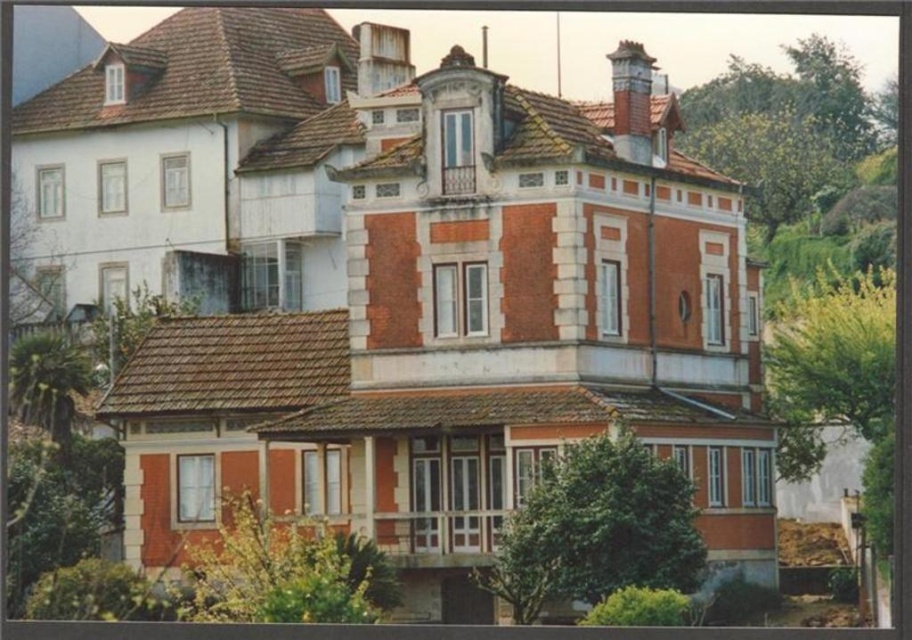
Is green leafy tree at center thinner than green leafy bush at lower left?

Yes, green leafy tree at center is thinner than green leafy bush at lower left.

Between green leafy tree at center and green leafy bush at lower left, which one has more height?

Standing taller between the two is green leafy bush at lower left.

You are a GUI agent. You are given a task and a screenshot of the screen. Output one action in this format:
    pyautogui.click(x=<x>, y=<y>)
    Task: Click on the green leafy tree at center
    This screenshot has width=912, height=640.
    Given the screenshot: What is the action you would take?
    pyautogui.click(x=596, y=529)

Identify the location of green leafy tree at center. The height and width of the screenshot is (640, 912). (596, 529).

Is point (226, 588) farther from viewer compared to point (758, 161)?

No, (226, 588) is in front of (758, 161).

Does green leafy bush at lower left have a lesser height compared to green leafy tree at upper right?

Yes, green leafy bush at lower left is shorter than green leafy tree at upper right.

Based on the photo, who is more forward, (225,516) or (811,116)?

Point (225,516) is in front.

Where is `green leafy bush at lower left`? This screenshot has height=640, width=912. green leafy bush at lower left is located at coordinates (275, 570).

Between point (696, 512) and point (832, 152), which one is positioned behind?

The point (832, 152) is more distant.

Where is `green leafy tree at center`? This screenshot has height=640, width=912. green leafy tree at center is located at coordinates (596, 529).

Image resolution: width=912 pixels, height=640 pixels. In order to click on green leafy tree at center in this screenshot , I will do `click(596, 529)`.